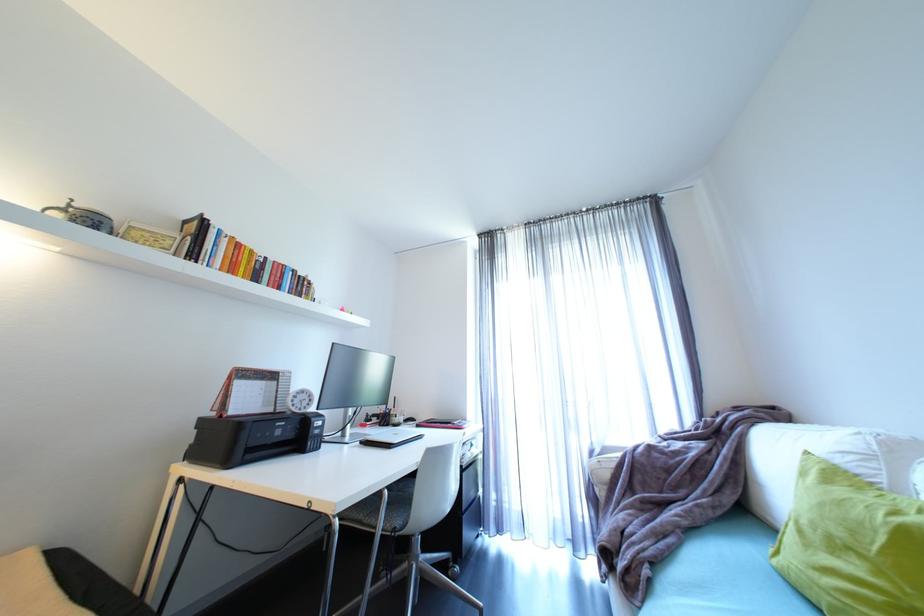
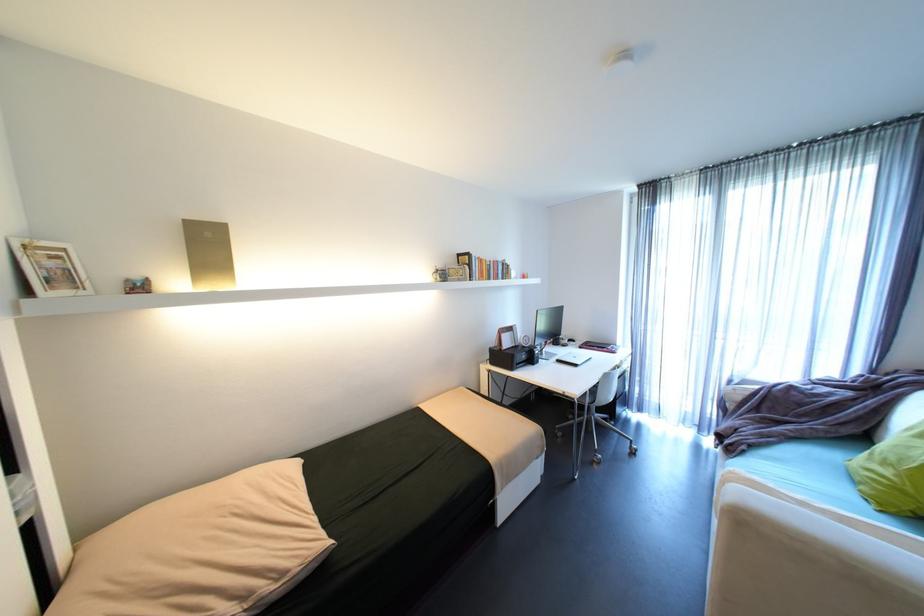
Locate, in the second image, the point that corresponds to pixel 341 344 in the first image.

(544, 310)